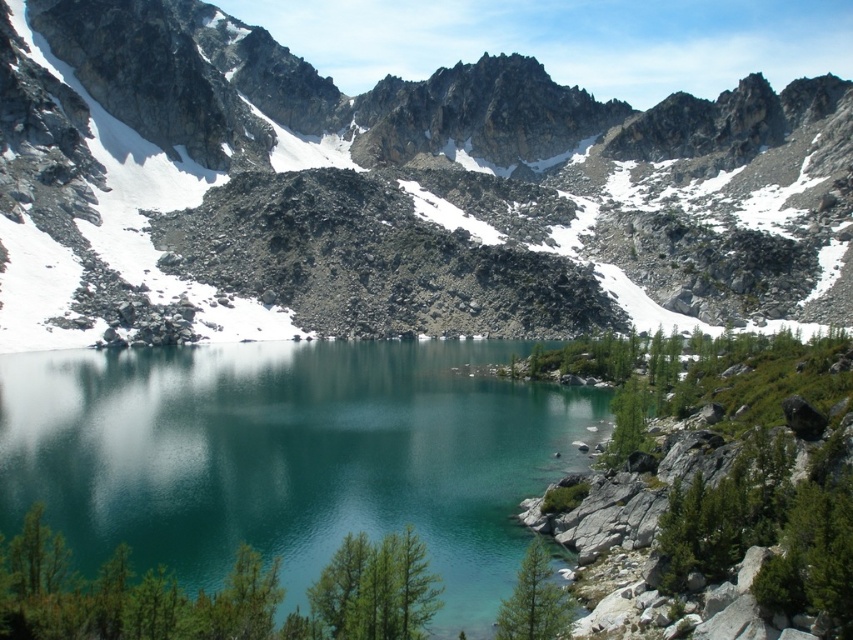
Can you confirm if rocky gray mountain at center is wider than teal glassy water at center?

Indeed, rocky gray mountain at center has a greater width compared to teal glassy water at center.

Describe the element at coordinates (392, 192) in the screenshot. I see `rocky gray mountain at center` at that location.

Find the location of a particular element. This screenshot has height=640, width=853. rocky gray mountain at center is located at coordinates (392, 192).